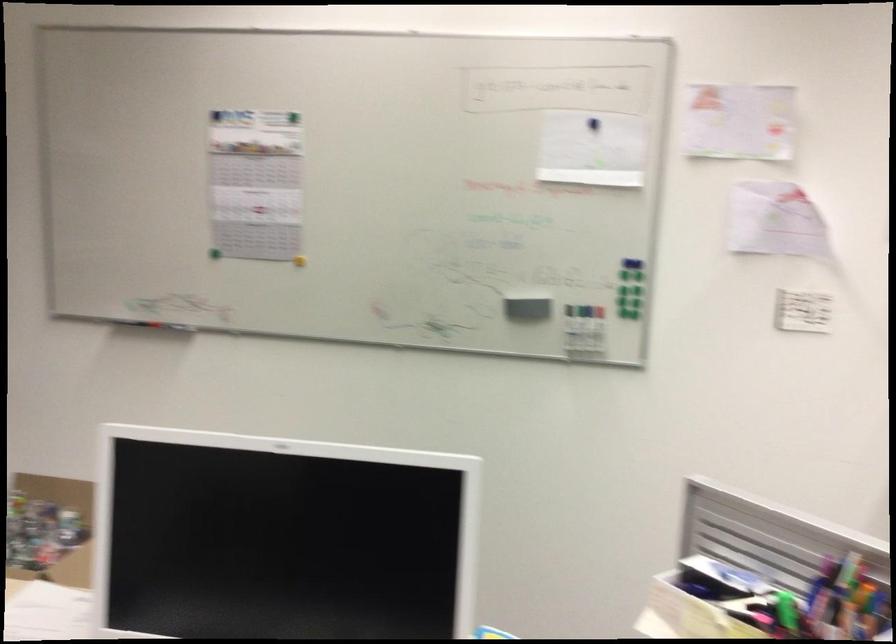
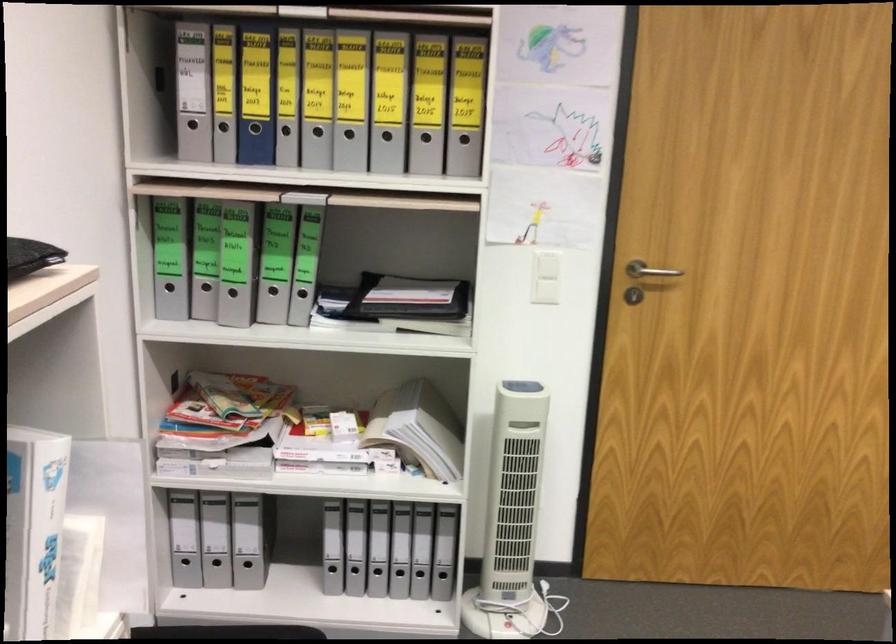
Question: The images are taken continuously from a first-person perspective. In which direction is your viewpoint rotating?

Choices:
 (A) Left
 (B) Right
 (C) Up
 (D) Down

Answer: (A)